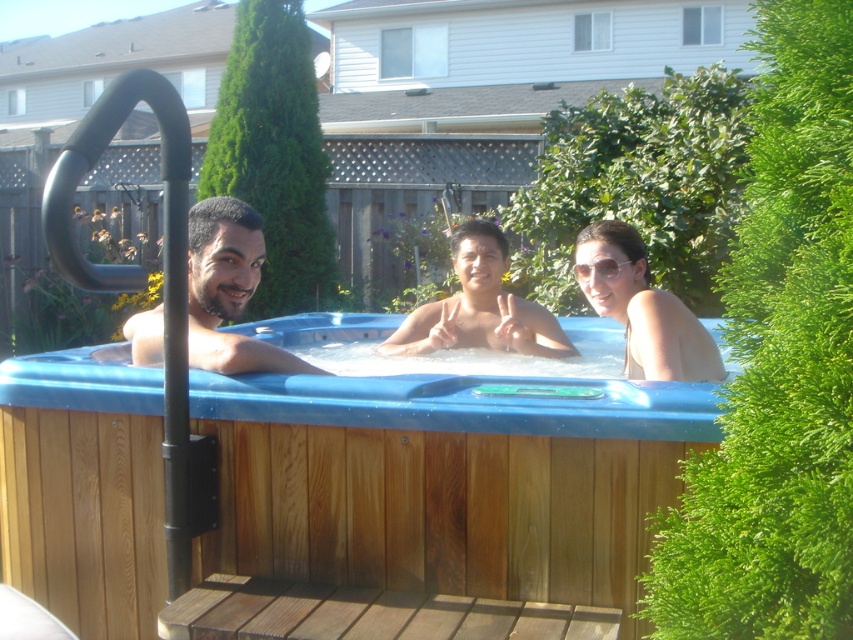
Question: Which point is farther from the camera taking this photo?

Choices:
 (A) (711, 353)
 (B) (196, 243)

Answer: (A)

Question: Among these objects, which one is farthest from the camera?

Choices:
 (A) matte black man at center
 (B) matte skin at center

Answer: (B)

Question: Which is farther from the matte skin at center?

Choices:
 (A) matte white bikini at center
 (B) matte black man at center
 (C) blue wood hot tub at center
 (D) brown wooden deck at lower center

Answer: (D)

Question: Can you confirm if matte black man at center is bigger than matte white bikini at center?

Choices:
 (A) no
 (B) yes

Answer: (B)

Question: Is matte black man at center positioned in front of matte skin at center?

Choices:
 (A) no
 (B) yes

Answer: (B)

Question: Is brown wooden deck at lower center smaller than matte black man at center?

Choices:
 (A) no
 (B) yes

Answer: (B)